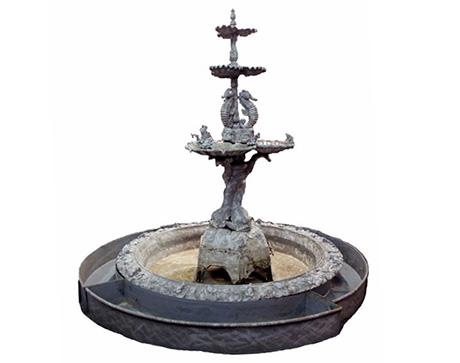
This screenshot has width=460, height=363. I want to click on larger plate, so click(229, 75).